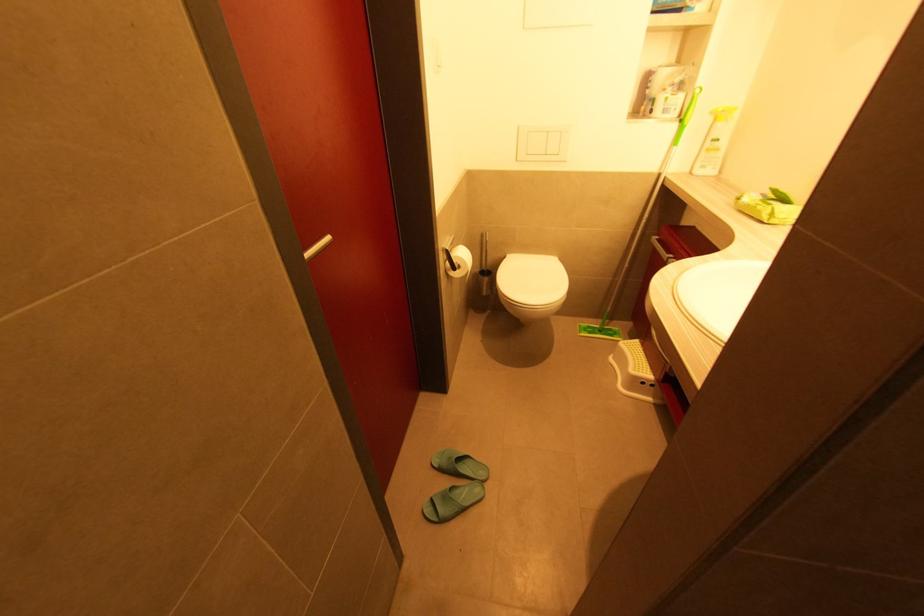
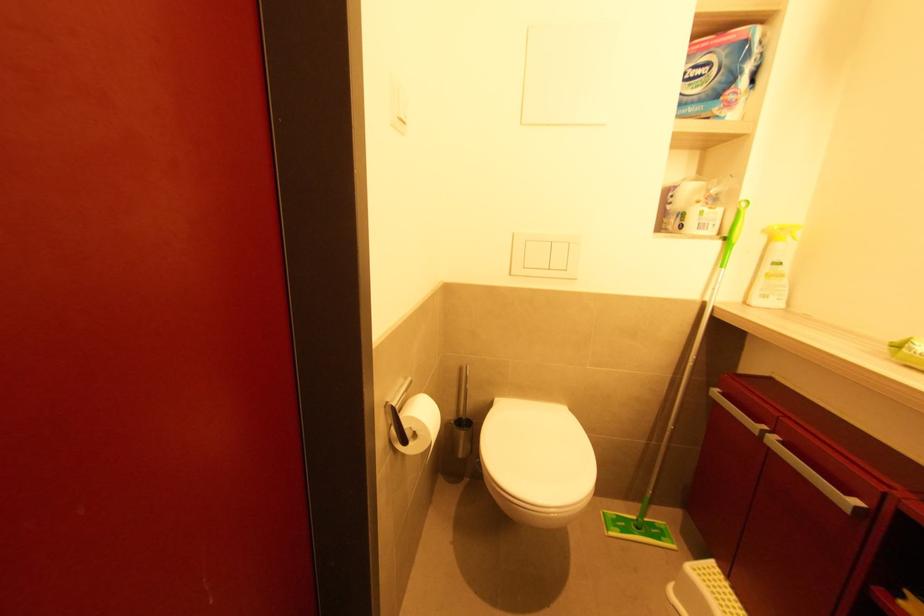
Question: Which direction would the cameraman need to move to produce the second image? Reply with the corresponding letter.

Choices:
 (A) Left
 (B) Right
 (C) Forward
 (D) Backward

Answer: (C)